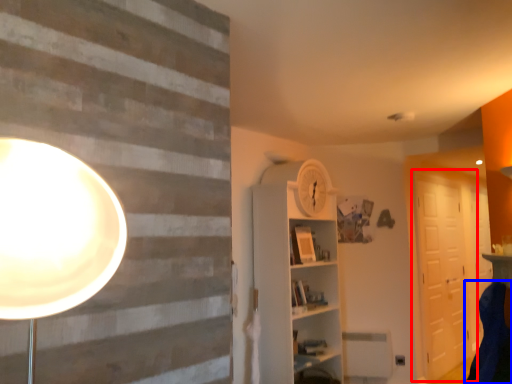
Question: Among these objects, which one is farthest to the camera, barn door (highlighted by a red box) or swivel chair (highlighted by a blue box)?

Choices:
 (A) barn door
 (B) swivel chair

Answer: (A)